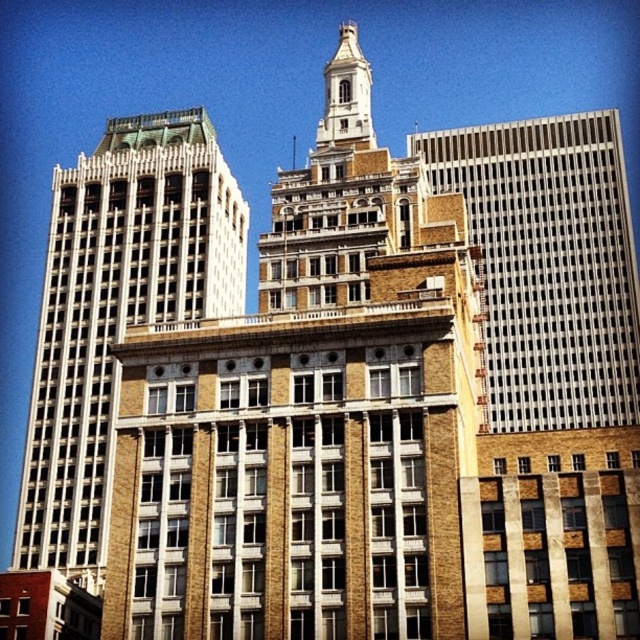
Image resolution: width=640 pixels, height=640 pixels. What do you see at coordinates (116, 310) in the screenshot? I see `brown brick bell tower at upper left` at bounding box center [116, 310].

Is point (76, 326) farther from camera compared to point (572, 342)?

No, (76, 326) is closer to viewer.

Identify the location of brown brick bell tower at upper left. (116, 310).

Between point (580, 296) and point (328, 77), which one is positioned behind?

The point (580, 296) is more distant.

Consider the image. Who is higher up, white glass skyscraper at right or brown stone tower at upper center?

brown stone tower at upper center

Is point (627, 403) behind point (342, 120)?

Yes, point (627, 403) is behind point (342, 120).

This screenshot has height=640, width=640. I want to click on white glass skyscraper at right, so click(x=548, y=264).

Does point (186, 272) come farther from viewer compared to point (336, 97)?

Yes, point (186, 272) is behind point (336, 97).

How distant is brown brick bell tower at upper left from brown stone tower at upper center?

brown brick bell tower at upper left and brown stone tower at upper center are 114.96 feet apart from each other.

Between point (244, 253) and point (349, 106), which one is positioned behind?

The point (244, 253) is behind.

At what (x,y) coordinates should I click in order to perform the action: click on brown brick bell tower at upper left. Please return your answer as a coordinate pair (x, y). This screenshot has width=640, height=640. Looking at the image, I should click on [116, 310].